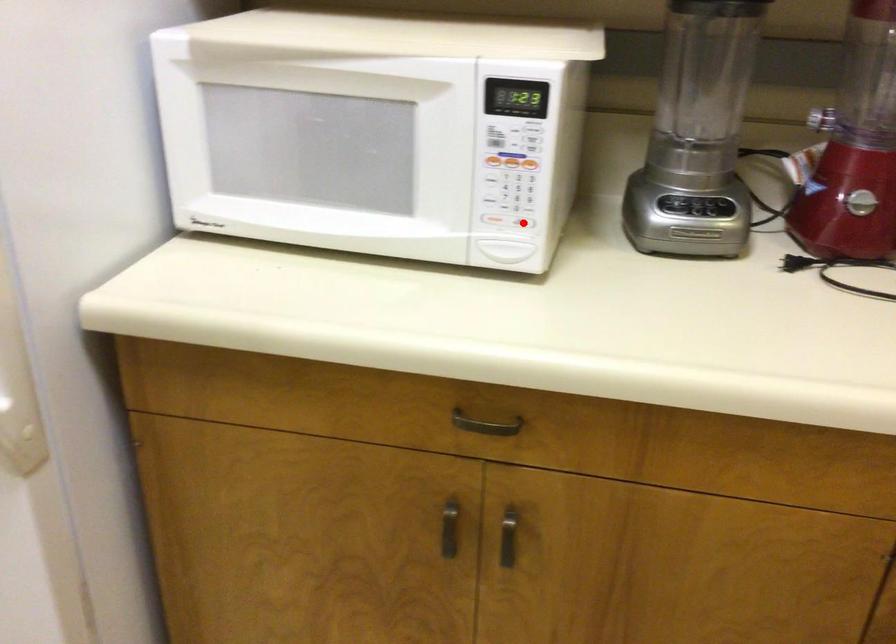
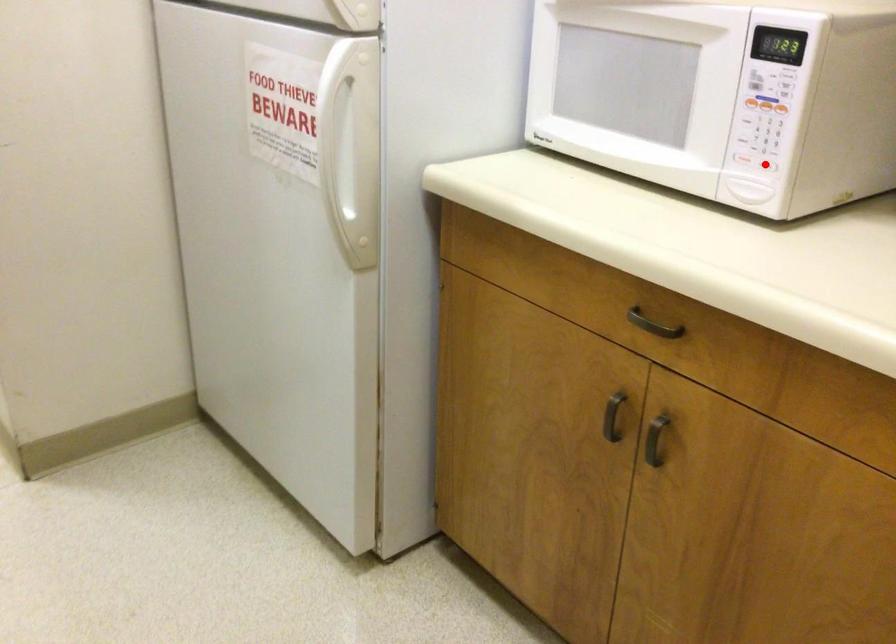
I am providing you with two images of the same scene from different viewpoints. A red point is marked on the first image and another point is marked on the second image. Is the red point in image1 aligned with the point shown in image2?

Yes